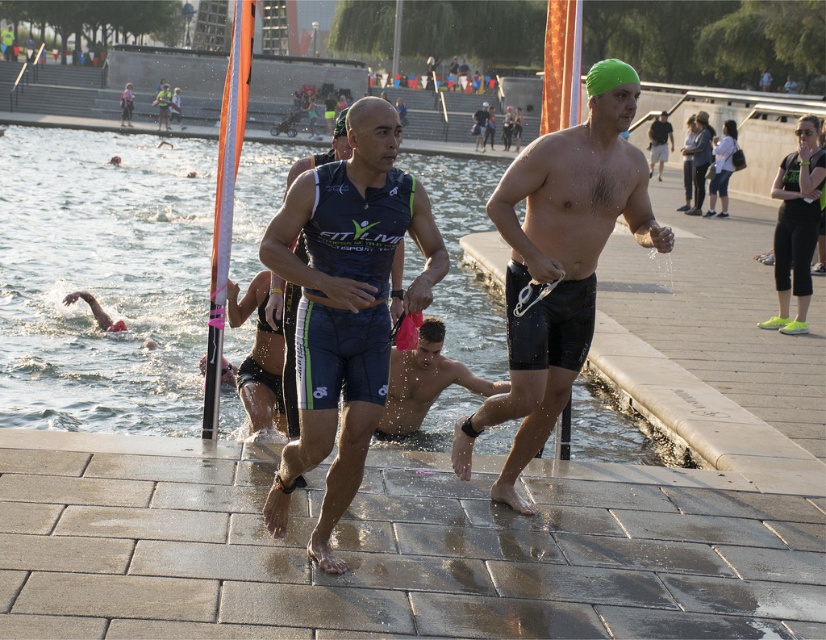
Question: Is blue athletic suit at center to the right of neon green athletic shoe at right from the viewer's perspective?

Choices:
 (A) no
 (B) yes

Answer: (A)

Question: Among these points, which one is nearest to the camera?

Choices:
 (A) (418, 211)
 (B) (615, 74)
 (C) (430, 376)

Answer: (A)

Question: Which object is the closest to the green matte swim cap at upper right?

Choices:
 (A) shiny wet skin at center
 (B) green swim cap at center

Answer: (B)

Question: Which object is closer to the camera taking this photo?

Choices:
 (A) green swim cap at center
 (B) shiny wet skin at center
 (C) blue athletic suit at center

Answer: (C)

Question: Is green swim cap at center above green matte swim cap at upper right?

Choices:
 (A) no
 (B) yes

Answer: (A)

Question: Can you confirm if green swim cap at center is positioned below neon green athletic shoe at right?

Choices:
 (A) yes
 (B) no

Answer: (A)